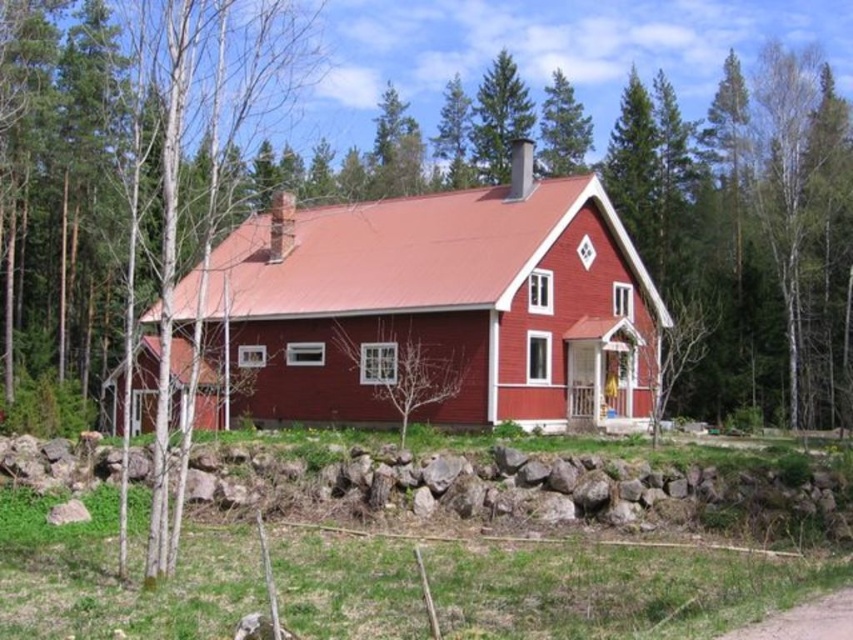
Question: Which point is closer to the camera?

Choices:
 (A) rocky terrain at lower center
 (B) green pine tree at upper center

Answer: (A)

Question: Which point is farther from the camera taking this photo?

Choices:
 (A) (490, 376)
 (B) (497, 173)
 (C) (840, 512)

Answer: (B)

Question: Is rocky terrain at lower center thinner than green textured pine tree at upper center?

Choices:
 (A) no
 (B) yes

Answer: (A)

Question: Which point appears farthest from the camera in this image?

Choices:
 (A) (733, 99)
 (B) (628, 522)
 (C) (454, 218)
 (D) (498, 93)

Answer: (D)

Question: Is matte red barn at center thinner than green textured pine tree at upper center?

Choices:
 (A) no
 (B) yes

Answer: (A)

Question: Is matte red barn at center to the right of green pine tree at upper center from the viewer's perspective?

Choices:
 (A) yes
 (B) no

Answer: (B)